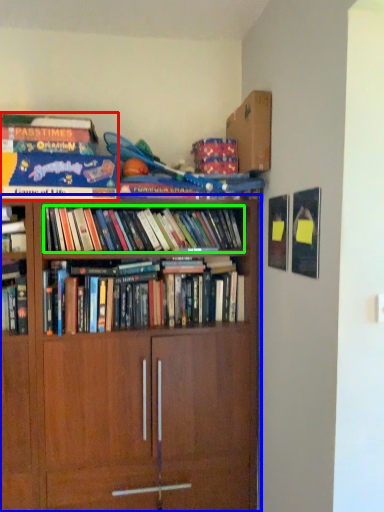
Question: Which is nearer to the book (highlighted by a red box)? bookcase (highlighted by a blue box) or book (highlighted by a green box).

Choices:
 (A) bookcase
 (B) book

Answer: (B)